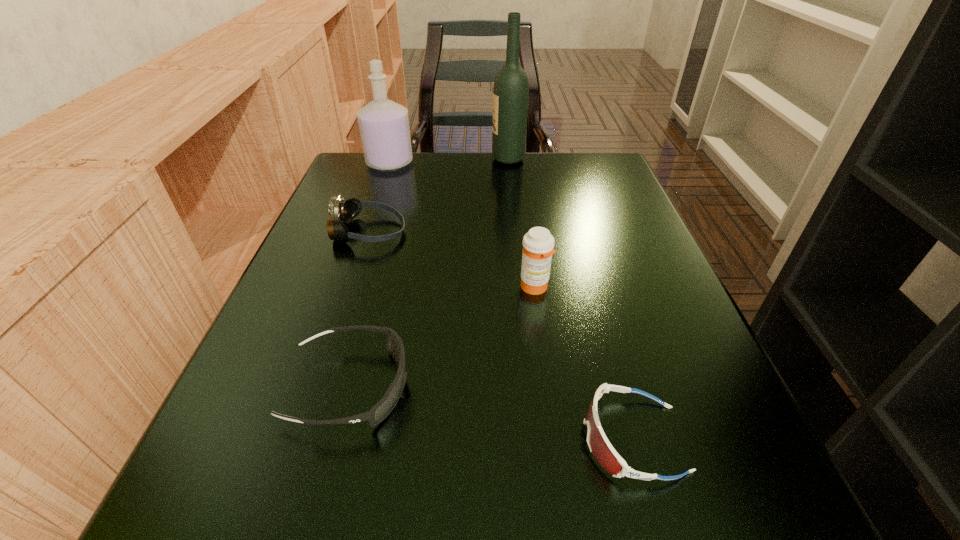
At what (x,y) coordinates should I click in order to perform the action: click on free space in the image that satisfies the following two spatial constraints: 1. on the labeled side of the tallest object; 2. on the left side of the third tallest object. Please return your answer as a coordinate pair (x, y). This screenshot has height=540, width=960. Looking at the image, I should click on (521, 287).

Locate an element on the screen. free space that satisfies the following two spatial constraints: 1. through the lenses of the fourth shortest object; 2. on the right side of the farthest goggles is located at coordinates (348, 287).